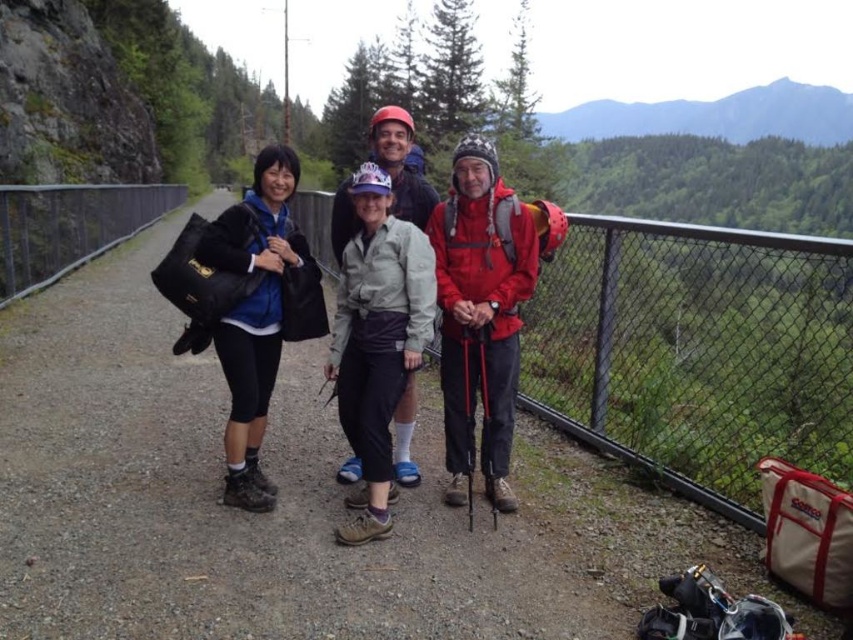
You are a hiker planning to take a photo of the group. The matte red jacket at center and the black matte jacket at left are both in your viewfinder. Which jacket will appear closer to the bottom of the photo?

The matte red jacket at center will appear closer to the bottom of the photo because it is positioned under the black matte jacket at left.

You are planning to take a photo of the group on the gravel path. You want to ensure the matte red jacket at center is in the foreground. Which direction should you move the camera to achieve this?

To place the matte red jacket at center in the foreground, move the camera backward so the jacket appears closer to the front of the image.